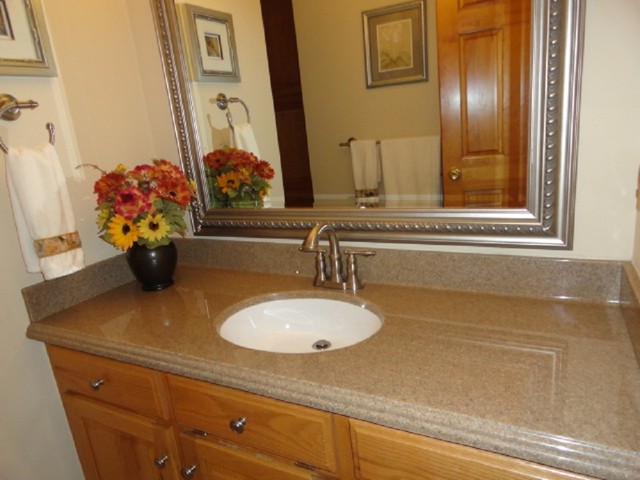
Identify the location of faucet. (312, 241).